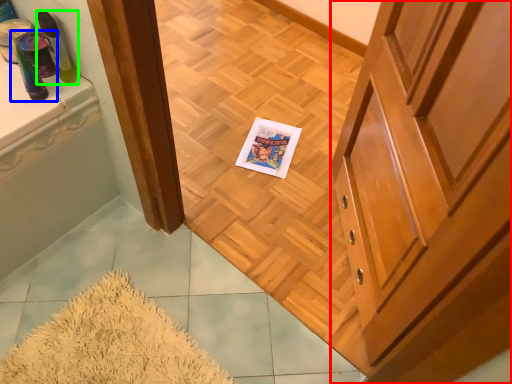
Question: Estimate the real-world distances between objects in this image. Which object is closer to cabinetry (highlighted by a red box), toiletry (highlighted by a blue box) or toiletry (highlighted by a green box)?

Choices:
 (A) toiletry
 (B) toiletry

Answer: (B)